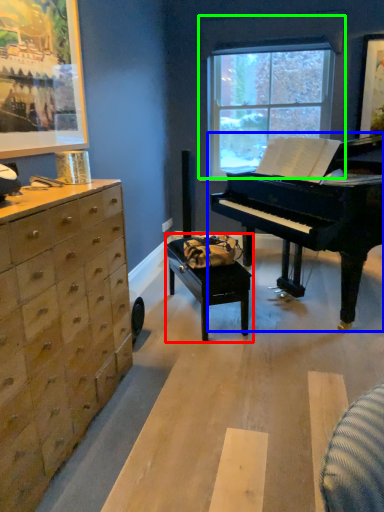
Question: Based on their relative distances, which object is farther from table (highlighted by a red box)? Choose from piano (highlighted by a blue box) and window (highlighted by a green box).

Choices:
 (A) piano
 (B) window

Answer: (B)